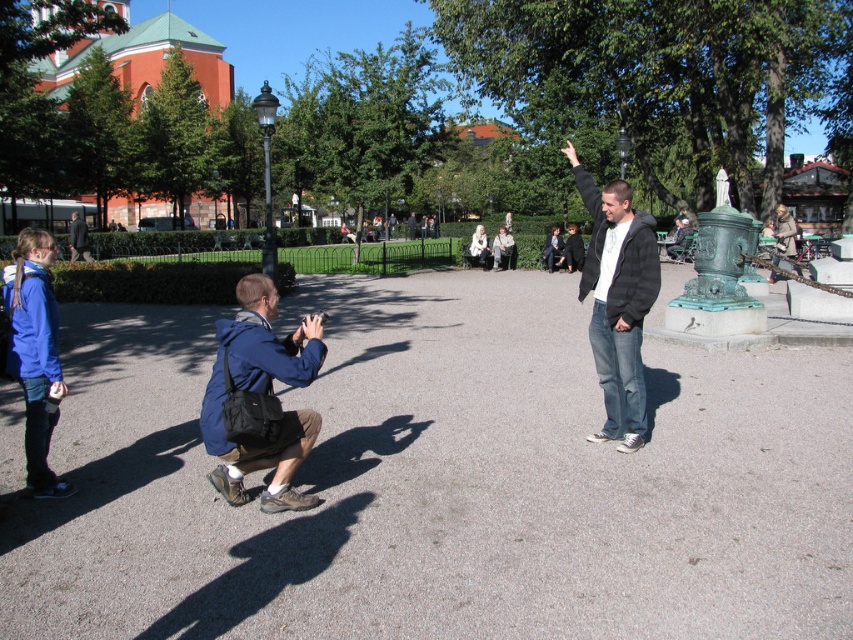
You are standing at the center of the park and want to take a photo of both the black hoodie at center and the blue denim jacket at lower left. Which one should you point your camera upwards to capture?

You should point your camera upwards to capture the black hoodie at center because it is above the blue denim jacket at lower left.

You are a photographer trying to capture a group photo of the blue denim jacket at lower left and the dark blue jacket at center. If you want to ensure both jackets are fully visible in the frame, which jacket should you position closer to the camera?

The blue denim jacket at lower left should be positioned closer to the camera because it is narrower than the dark blue jacket at center, allowing it to fit better in the frame without being cropped out.

From the picture: You are standing at the point with coordinates point [28,307] and want to walk to the point with coordinates point [630,196]. Is there any obstruction between you and your destination?

The point [630,196] is behind point [28,307], so there is an obstruction between them, meaning you cannot walk directly to the destination without going around.